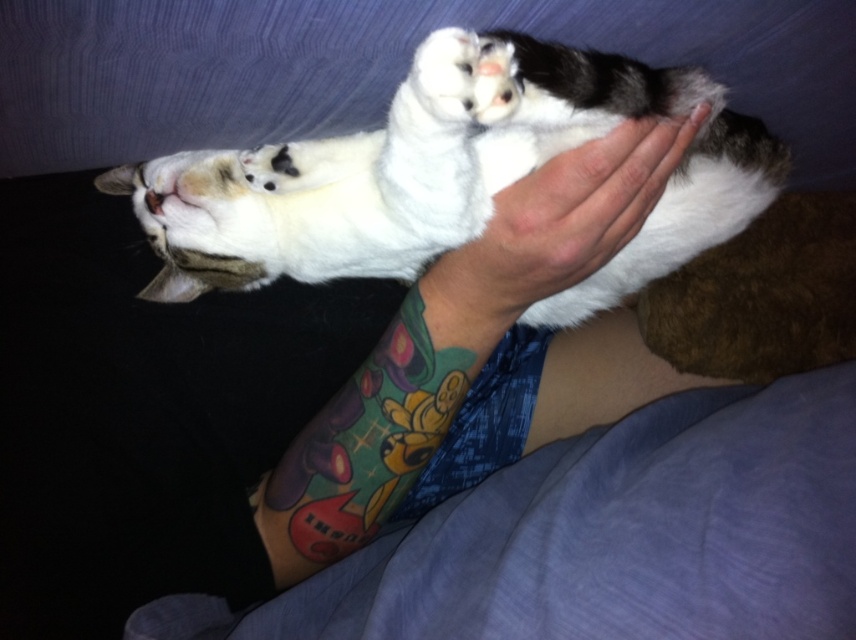
Question: Among these objects, which one is farthest from the camera?

Choices:
 (A) multicolored tattooed arm at center
 (B) smooth skin hand at center
 (C) white soft fur cat at center

Answer: (B)

Question: Does multicolored tattooed arm at center have a larger size compared to smooth skin hand at center?

Choices:
 (A) no
 (B) yes

Answer: (B)

Question: Is white soft fur cat at center below smooth skin hand at center?

Choices:
 (A) yes
 (B) no

Answer: (B)

Question: Considering the real-world distances, which object is farthest from the smooth skin hand at center?

Choices:
 (A) multicolored tattooed arm at center
 (B) white soft fur cat at center

Answer: (B)

Question: Which point is farther to the camera?

Choices:
 (A) multicolored tattooed arm at center
 (B) smooth skin hand at center

Answer: (B)

Question: Does white soft fur cat at center appear over multicolored tattooed arm at center?

Choices:
 (A) no
 (B) yes

Answer: (B)